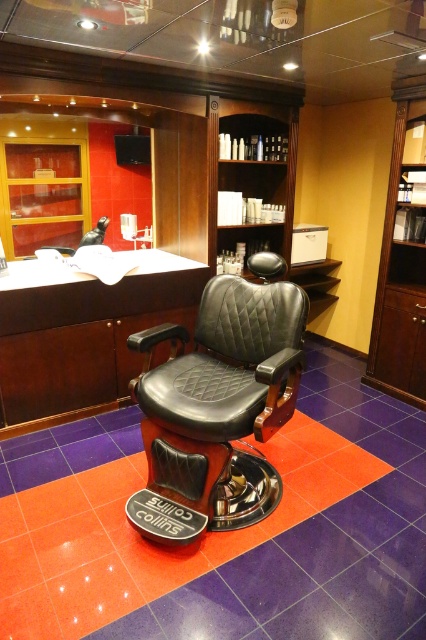
You are a customer entering the barbershop and want to sit in the black leather swivel chair at center. There is a wooden bookshelf at right nearby. Which object is closer to you as you enter?

The black leather swivel chair at center is closer to you than the wooden bookshelf at right as you enter the barbershop.